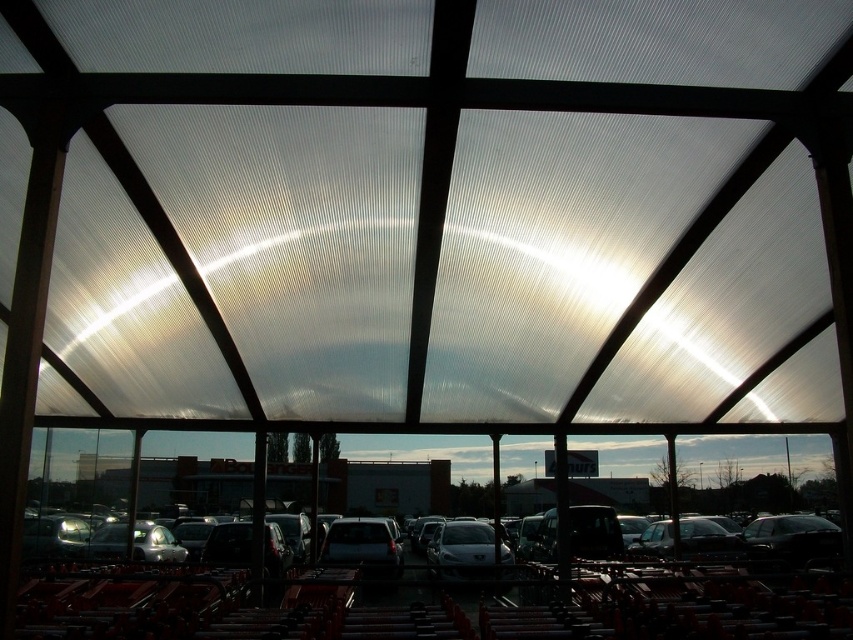
Looking at this image, you are standing at the edge of the covered parking area and want to take a photo of the metallic gray cars at center. Your camera is 4.07 meters away from the cars. If your camera has a maximum focus range of 4 meters, will it be able to capture the cars clearly?

The metallic gray cars at center and camera are 4.07 meters apart from each other. Since the camera can only focus up to 4 meters, it will not be able to capture the cars clearly as they are slightly beyond the maximum focus range.

You are a delivery person who needs to park a large delivery van that is 6 meters long. You see the metallic gray cars at center and the matte black suv at center in the parking space. Which vehicle should you move to make space for your van?

The metallic gray cars at center is larger in size than matte black suv at the center, so you should move the metallic gray cars at center to make space for the van since it occupies more space.

You are standing inside the covered parking area and want to exit towards the open sky. You see a metallic gray cars at center and a matte black suv at center. Which vehicle should you move around to reach the exit more easily?

The metallic gray cars at center is closer to the viewer than the matte black suv at center, so you should move around the metallic gray cars at center to reach the exit more easily as it is in your immediate vicinity.